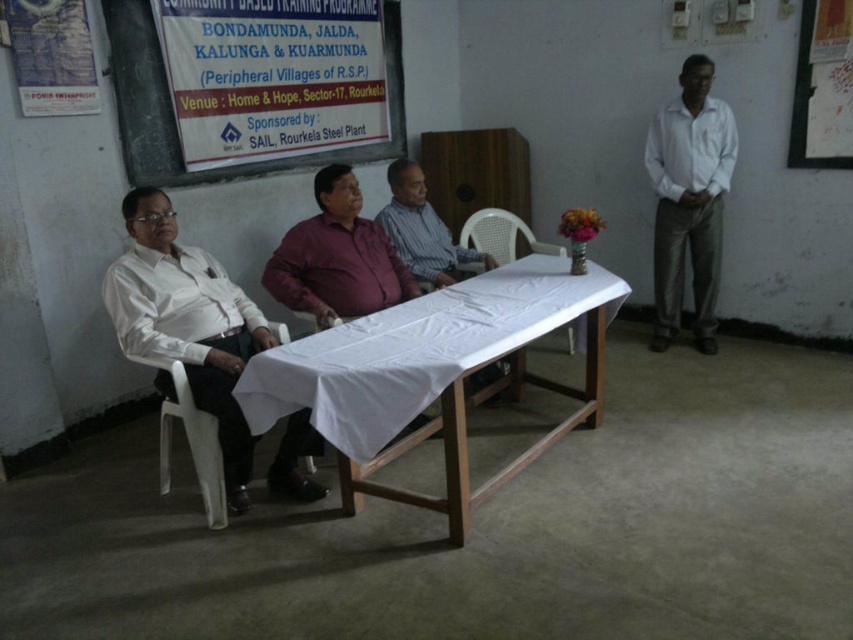
You are standing at the entrance of the room and see the white wooden table at center and the white smooth shirt at right. Which object is closer to the entrance?

The white wooden table at center is closer to the entrance because it is positioned below the white smooth shirt at right, indicating it is lower in the visual hierarchy and likely closer to the viewer.

You are standing at the entrance of the room and want to approach the white glossy shirt at left and the white plastic chair at center. Which object will you encounter first as you walk towards them?

The white glossy shirt at left will be encountered first because it is closer to the viewer than the white plastic chair at center.

You are a server carrying a tray of drinks. You need to place a drink in front of each of the two men wearing the white smooth shirt at right and the striped fabric shirt at center. The tray can hold drinks for a maximum distance of 1.5 meters between them. Can you serve both without moving the tray?

The distance between the white smooth shirt at right and the striped fabric shirt at center is 1.38 meters, which is within the tray capacity of 1.5 meters. Yes, you can serve both without moving the tray.